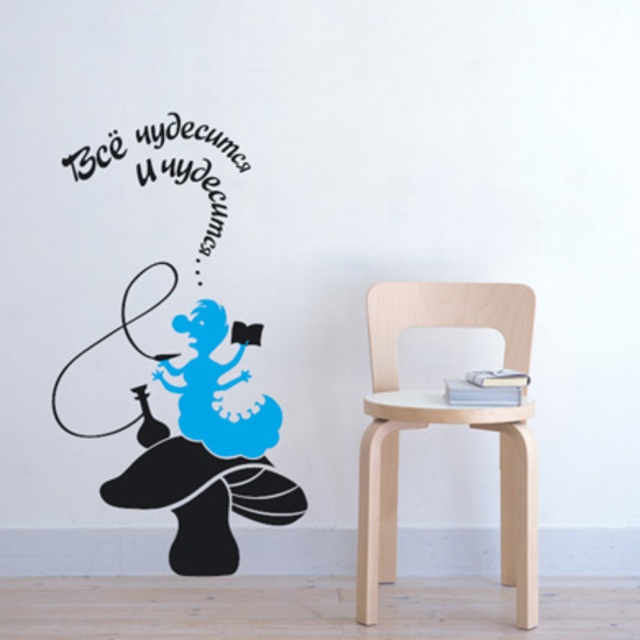
You are designing a living room layout and need to place the birch wood chair at right and the blue matte figure at upper left. Considering their widths, which object should be placed closer to the entrance for better space management?

The birch wood chair at right has a lesser width compared to the blue matte figure at upper left. To optimize space, the narrower birch wood chair at right should be placed closer to the entrance, allowing the wider blue matte figure at upper left to be positioned where there is more space available.

You are an interior designer assessing the wall art. Based on the scene, which object is taller between the blue matte figure at upper left and the black vinyl text at upper left?

The blue matte figure at upper left is taller than the black vinyl text at upper left according to the description.

You are a painter standing in front of the wall with the graphic design. You want to place a new canvas that is 1.2 meters tall. Can the birch wood chair at right support the canvas without blocking the black vinyl text at upper left?

The birch wood chair at right is taller than the black vinyl text at upper left. Since the chair is taller, placing a 1.2m canvas on it might reach above the text, potentially blocking it. Ensure the canvas is positioned lower or use a shorter support.